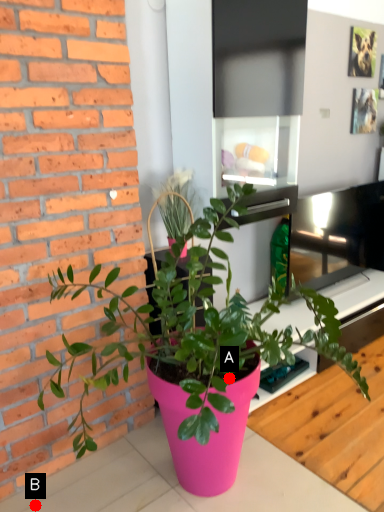
Question: Two points are circled on the image, labeled by A and B beside each circle. Which point is farther from the camera taking this photo?

Choices:
 (A) A is further
 (B) B is further

Answer: (B)